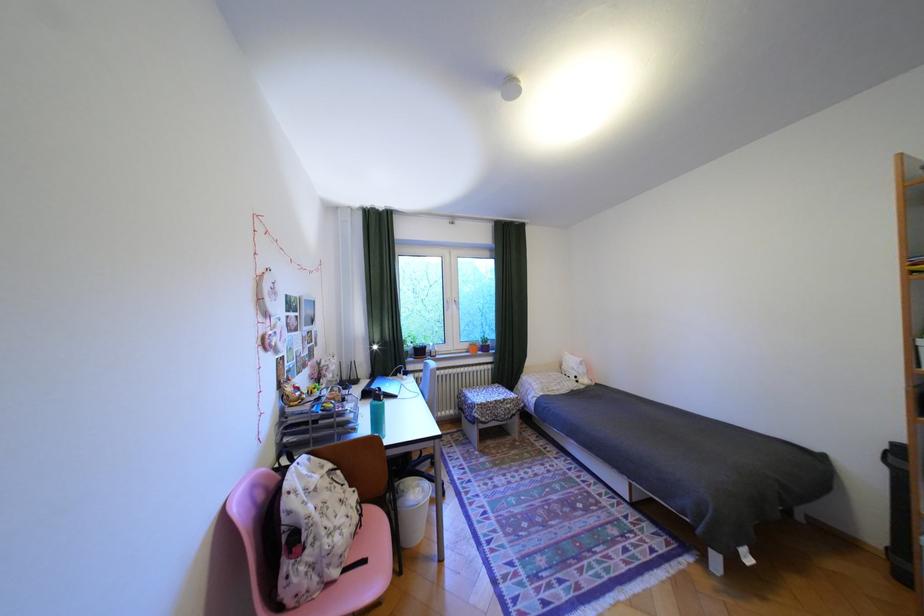
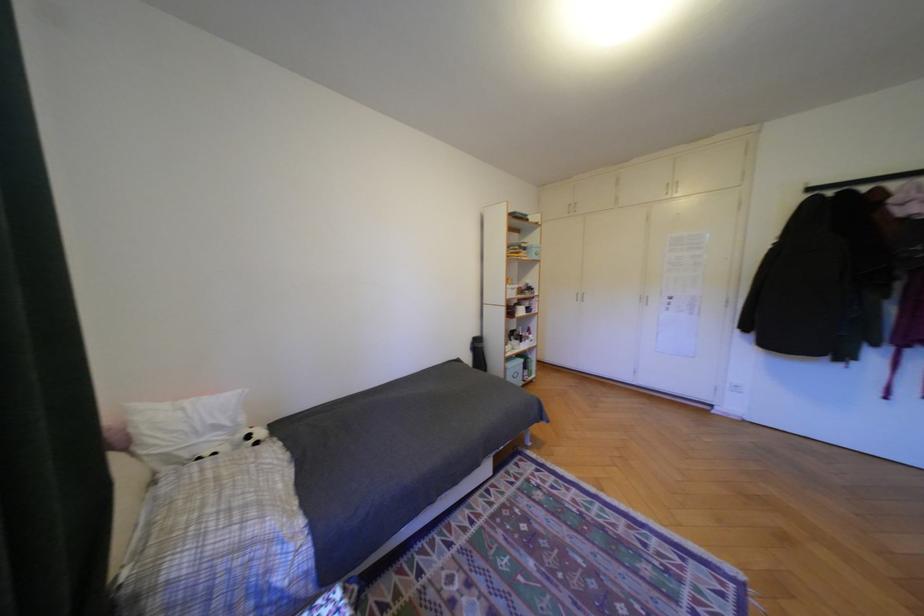
In the second image, find the point that corresponds to [588,378] in the first image.

(261, 437)